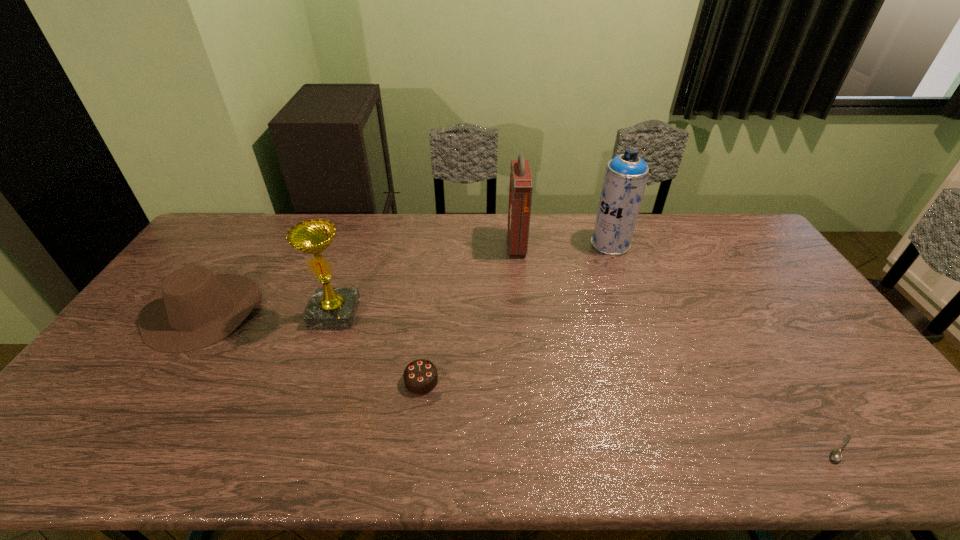
You are a GUI agent. You are given a task and a screenshot of the screen. Output one action in this format:
    pyautogui.click(x=<x>, y=<y>)
    Task: Click on the second object from right to left
    This screenshot has height=540, width=960.
    Given the screenshot: What is the action you would take?
    pyautogui.click(x=626, y=175)

Where is `the first-aid kit`? the first-aid kit is located at coordinates (521, 183).

Locate an element on the screen. The height and width of the screenshot is (540, 960). the fifth object from right to left is located at coordinates (330, 308).

Locate an element on the screen. This screenshot has height=540, width=960. the third shortest object is located at coordinates (195, 308).

Where is `cowboy hat`? cowboy hat is located at coordinates (195, 308).

This screenshot has width=960, height=540. In order to click on chocolate cake in this screenshot , I will do `click(420, 377)`.

Where is `the second shortest object`? The width and height of the screenshot is (960, 540). the second shortest object is located at coordinates (420, 377).

The height and width of the screenshot is (540, 960). What are the coordinates of `the rightmost object` in the screenshot? It's located at coord(835,455).

This screenshot has height=540, width=960. I want to click on the shortest object, so click(x=835, y=455).

What are the coordinates of `free spot located on the right of the aerosol can` in the screenshot? It's located at (735, 244).